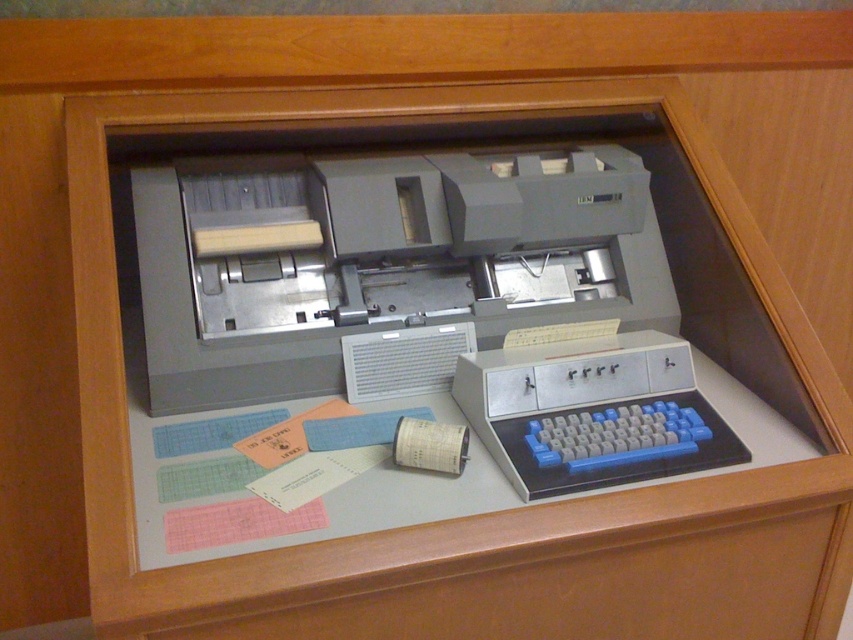
Between point (262, 216) and point (503, 368), which one is positioned in front?

Point (503, 368) is in front.

Is matte gray printer at center taller than blue plastic keyboard at center?

Yes, matte gray printer at center is taller than blue plastic keyboard at center.

Is point (291, 285) positioned before point (486, 387)?

That is False.

Where is `matte gray printer at center`? This screenshot has height=640, width=853. matte gray printer at center is located at coordinates (381, 260).